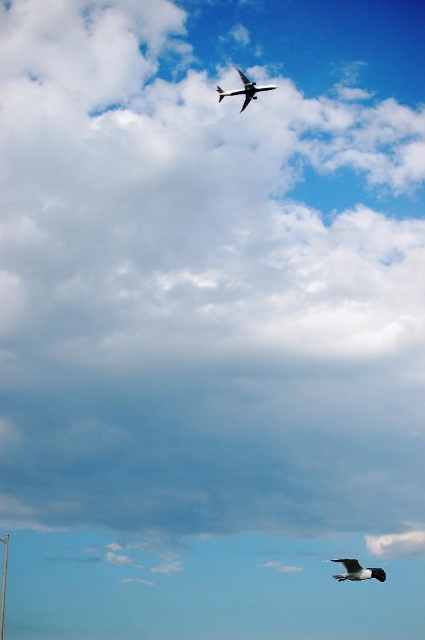
You are a photographer trying to capture a clear shot of both the airplane and the bird. You notice two points in the sky, point A at coordinates point A is point (362, 576) and point B at coordinates point B is point (227, 92). Which point should you focus on first to ensure both subjects are in focus?

You should focus on point A at coordinates point A is point (362, 576) first because it is closer to the camera than point B at coordinates point B is point (227, 92). This ensures that the airplane, which is likely near point A, will be in focus before adjusting for the bird at point B.

You are a photographer trying to capture an image of a bird located at point (357, 572). The camera you are using has a focal length of 50mm and a sensor size of 24mm x 36mm. If the bird is 295.14 feet away from the camera, what is the approximate angle of view required to frame the bird within the sensor dimensions?

The angle of view required can be calculated using the formula for angle of view, which is 2 arctan. However, since the bird is 295.14 feet away and the sensor size is 24mm x 36mm, the horizontal angle of view would be approximately 2 arctan. The vertical angle of view would be 2 arctan. To frame the bird within the sensor dimensions, the photographer should ensure the angle of view covers the bird at that distance.

You are a pilot in the airplane near the top center of the frame. You notice a white feathered bird at lower center. Based on the coordinates provided, is the bird positioned to the left or right of the airplane?

The white feathered bird at lower center is positioned at coordinates 0.892 on the x axis and 0.842 on the y axis. Since the airplane is near the top center, its x coordinate would be around 0.5. Comparing the x coordinates, the bird is to the right of the airplane.